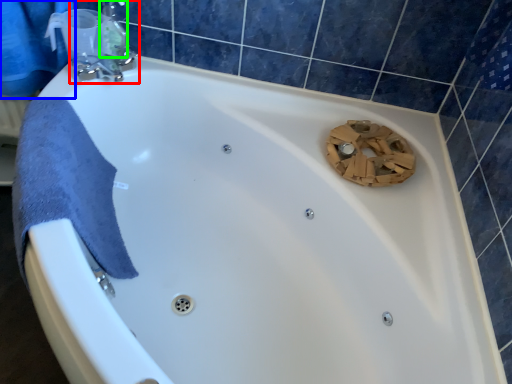
Question: Estimate the real-world distances between objects in this image. Which object is farther from tap (highlighted by a red box), shower curtain (highlighted by a blue box) or toiletry (highlighted by a green box)?

Choices:
 (A) shower curtain
 (B) toiletry

Answer: (A)